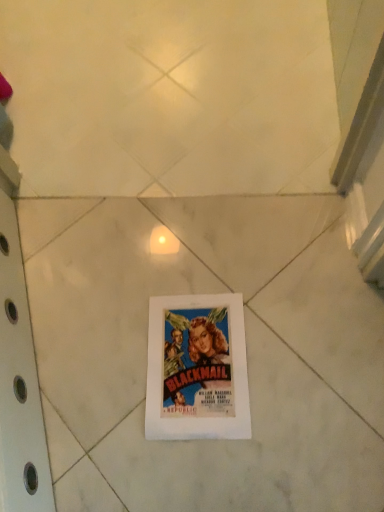
The height and width of the screenshot is (512, 384). Find the location of `blank space above white paper at center (from a real-world perspective)`. blank space above white paper at center (from a real-world perspective) is located at coordinates pyautogui.click(x=182, y=333).